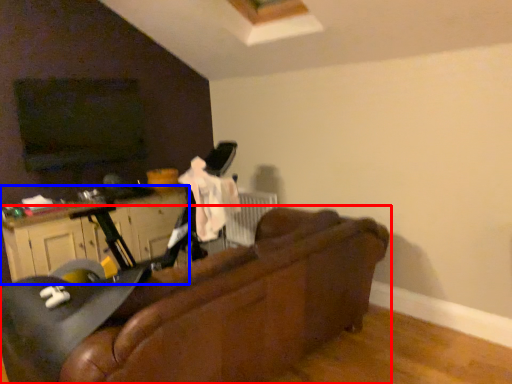
Question: Which object is closer to the camera taking this photo, studio couch (highlighted by a red box) or dresser (highlighted by a blue box)?

Choices:
 (A) studio couch
 (B) dresser

Answer: (A)